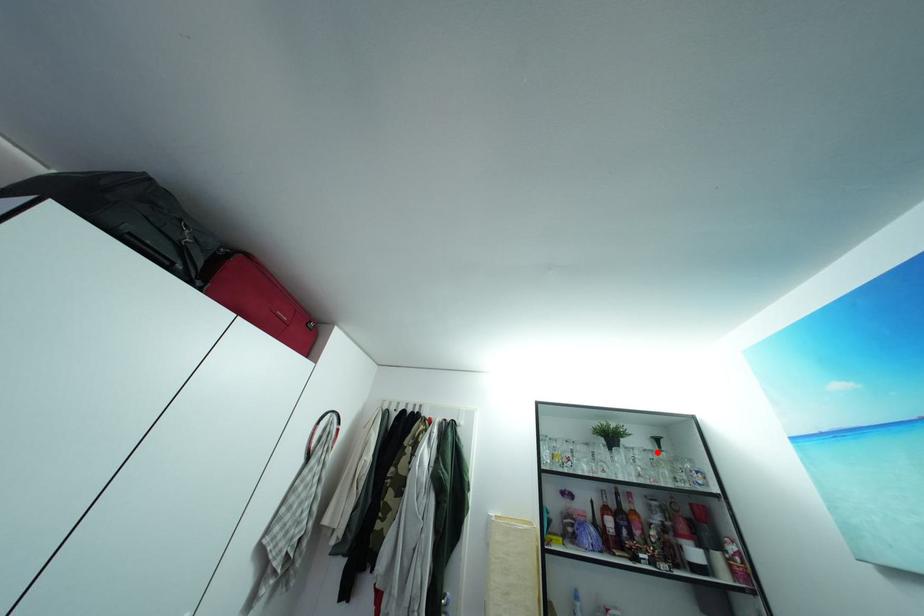
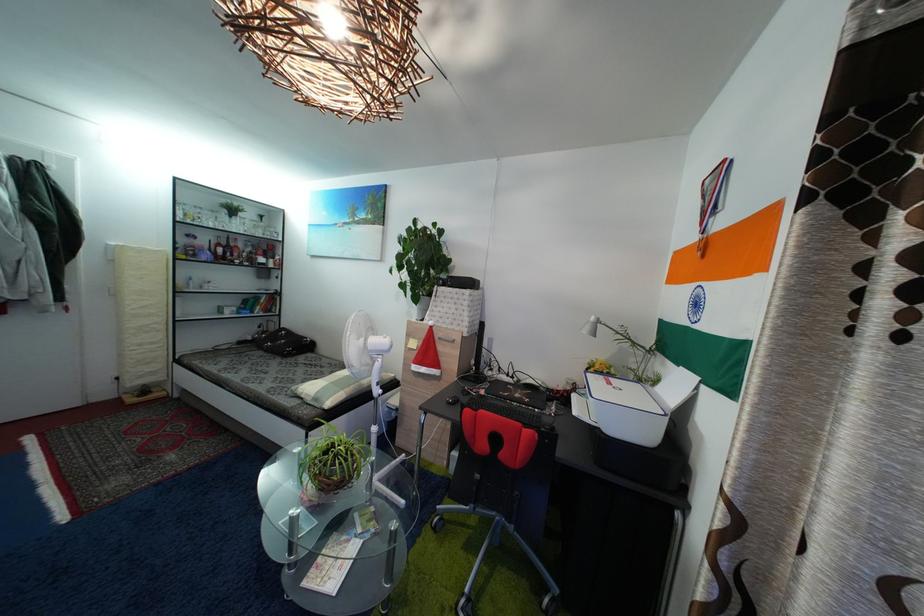
Question: I am providing you with two images of the same scene from different viewpoints. Given a red point in image1, look at the same physical point in image2. Is it:

Choices:
 (A) Closer to the viewpoint
 (B) Farther from the viewpoint

Answer: (A)